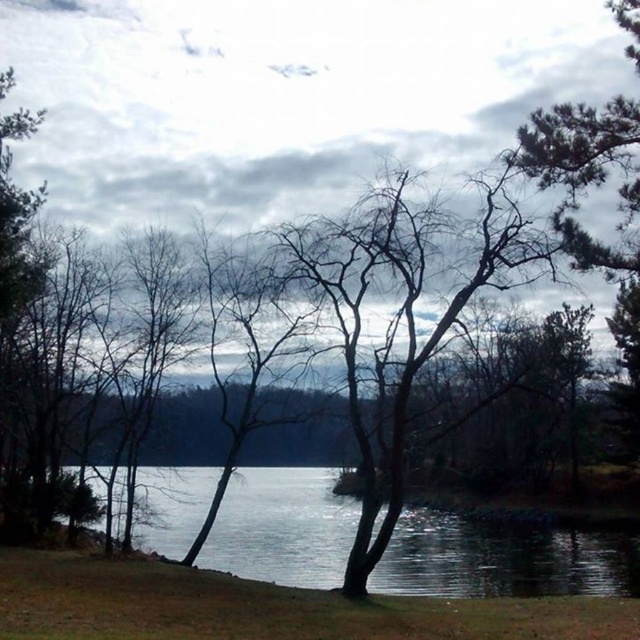
Does transparent water at center appear under bare branches at center?

Yes, transparent water at center is below bare branches at center.

Is point (337, 572) positioned before point (337, 228)?

That is False.

Does point (202, 506) lie behind point (406, 381)?

Yes, it is behind point (406, 381).

Find the location of a particular element. This screenshot has width=640, height=640. transparent water at center is located at coordinates (500, 557).